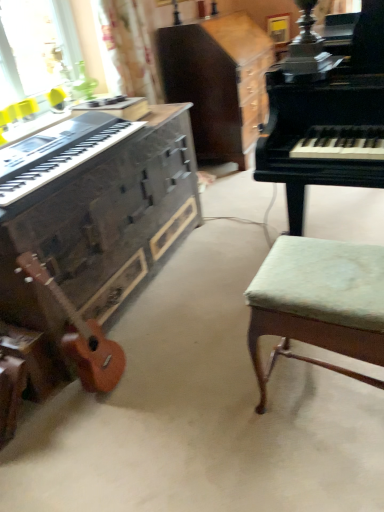
Question: From the image's perspective, is green fabric stool at right on top of matte black keyboard at left?

Choices:
 (A) yes
 (B) no

Answer: (B)

Question: Is green fabric stool at right next to matte black keyboard at left and touching it?

Choices:
 (A) no
 (B) yes

Answer: (A)

Question: Is green fabric stool at right in front of matte black keyboard at left?

Choices:
 (A) no
 (B) yes

Answer: (B)

Question: Can you confirm if green fabric stool at right is thinner than matte black keyboard at left?

Choices:
 (A) no
 (B) yes

Answer: (B)

Question: Is green fabric stool at right behind matte black keyboard at left?

Choices:
 (A) no
 (B) yes

Answer: (A)

Question: Looking at their shapes, would you say wooden cabinet at center is wider or thinner than matte black keyboard at left?

Choices:
 (A) wide
 (B) thin

Answer: (A)

Question: From a real-world perspective, is wooden cabinet at center above or below matte black keyboard at left?

Choices:
 (A) below
 (B) above

Answer: (A)

Question: Visually, is wooden cabinet at center positioned to the left or to the right of matte black keyboard at left?

Choices:
 (A) right
 (B) left

Answer: (A)

Question: From the image's perspective, is wooden cabinet at center positioned above or below matte black keyboard at left?

Choices:
 (A) above
 (B) below

Answer: (A)

Question: Considering the positions of wooden piano at left, which ranks as the 2th piano in right-to-left order, and matte black keyboard at left in the image, is wooden piano at left, which ranks as the 2th piano in right-to-left order, wider or thinner than matte black keyboard at left?

Choices:
 (A) wide
 (B) thin

Answer: (A)

Question: Would you say wooden piano at left, which ranks as the 2th piano in right-to-left order, is to the left or to the right of matte black keyboard at left in the picture?

Choices:
 (A) right
 (B) left

Answer: (A)

Question: Considering the positions of wooden piano at left, which ranks as the 2th piano in right-to-left order, and matte black keyboard at left in the image, is wooden piano at left, which ranks as the 2th piano in right-to-left order, bigger or smaller than matte black keyboard at left?

Choices:
 (A) small
 (B) big

Answer: (B)

Question: Considering the positions of wooden piano at left, which ranks as the 2th piano in right-to-left order, and matte black keyboard at left in the image, is wooden piano at left, which ranks as the 2th piano in right-to-left order, taller or shorter than matte black keyboard at left?

Choices:
 (A) tall
 (B) short

Answer: (A)

Question: In terms of size, does wooden piano at left, arranged as the 1th piano when viewed from the left, appear bigger or smaller than wooden cabinet at center?

Choices:
 (A) small
 (B) big

Answer: (A)

Question: From the image's perspective, is wooden piano at left, which ranks as the 2th piano in right-to-left order, above or below wooden cabinet at center?

Choices:
 (A) above
 (B) below

Answer: (B)